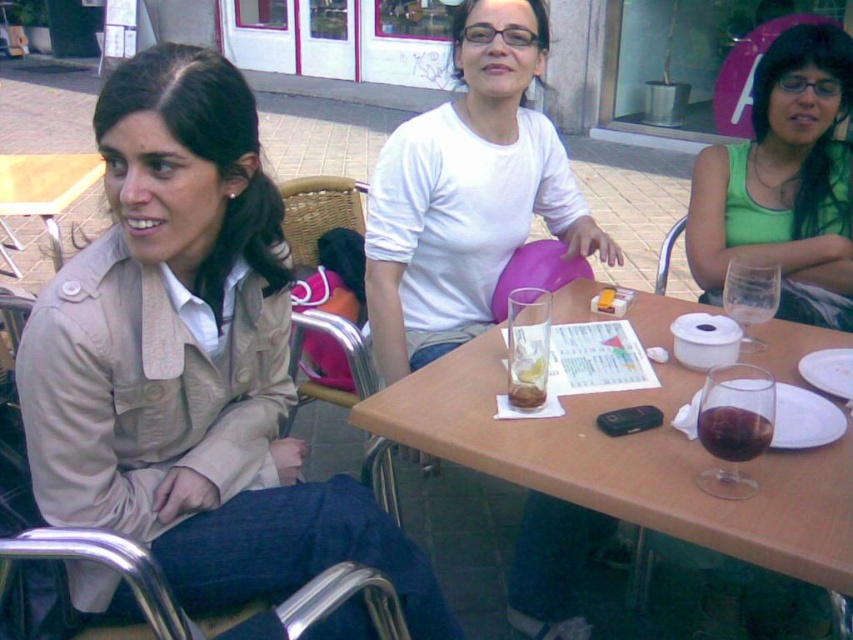
You are a photographer standing 6 feet away from the camera. You see the green matte tank top at upper right and the camera. Can you take a photo of the tank top without moving closer than 6 feet?

The green matte tank top at upper right and camera are 5.98 feet apart. Since you are standing 6 feet away from the camera, the distance between you and the tank top would be approximately 11.98 feet. This distance may make it difficult to capture a clear photo without moving closer.

You are standing at the point labeled as point [521,397] and want to walk towards the point labeled as point [6,257]. Which direction should you move in?

You should move towards the point [6,257] by going forward since it is behind point [521,397].

Consider the image. You are a server at the outdoor dining area. You need to place a new order of a 12 inch tall cake on the table. Which item, the beige fabric jacket at left or the smooth brown bread at center, should you avoid placing the cake on top of to prevent it from being hidden?

The beige fabric jacket at left is much taller than the smooth brown bread at center, so placing the cake on top of the beige fabric jacket at left would hide the cake more than the smooth brown bread at center. Therefore, to prevent the cake from being hidden, you should avoid placing it on the beige fabric jacket at left.